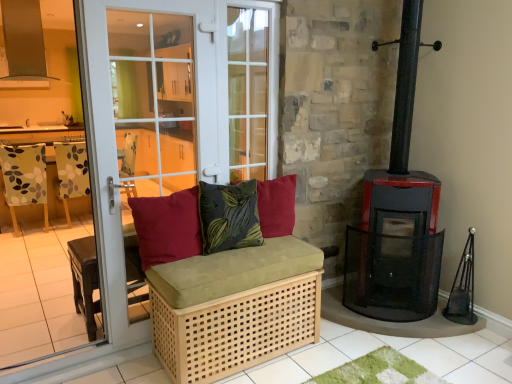
Identify the location of free space between natural wood woven basket at lower center and black metal wood burning stove at right. (342, 347).